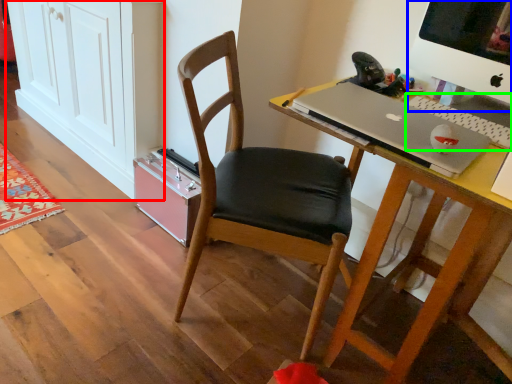
Question: Which object is the closest to the cabinetry (highlighted by a red box)? Choose among these: computer monitor (highlighted by a blue box) or laptop keyboard (highlighted by a green box).

Choices:
 (A) computer monitor
 (B) laptop keyboard

Answer: (A)